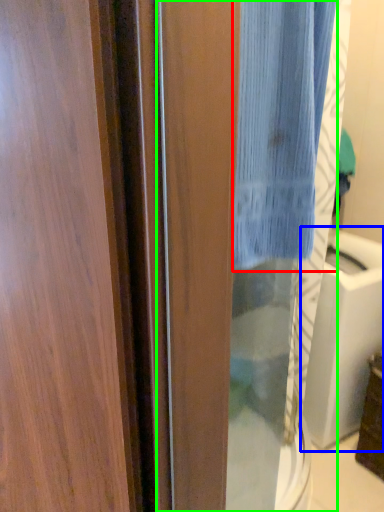
Question: Which is farther away from curtain (highlighted by a red box)? sink (highlighted by a blue box) or screen door (highlighted by a green box)?

Choices:
 (A) sink
 (B) screen door

Answer: (A)